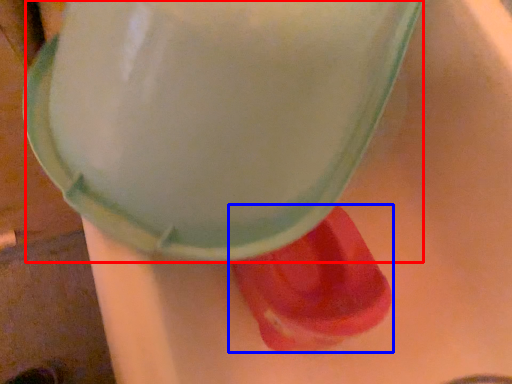
Question: Which object appears closest to the camera in this image, foam (highlighted by a red box) or footwear (highlighted by a blue box)?

Choices:
 (A) foam
 (B) footwear

Answer: (A)